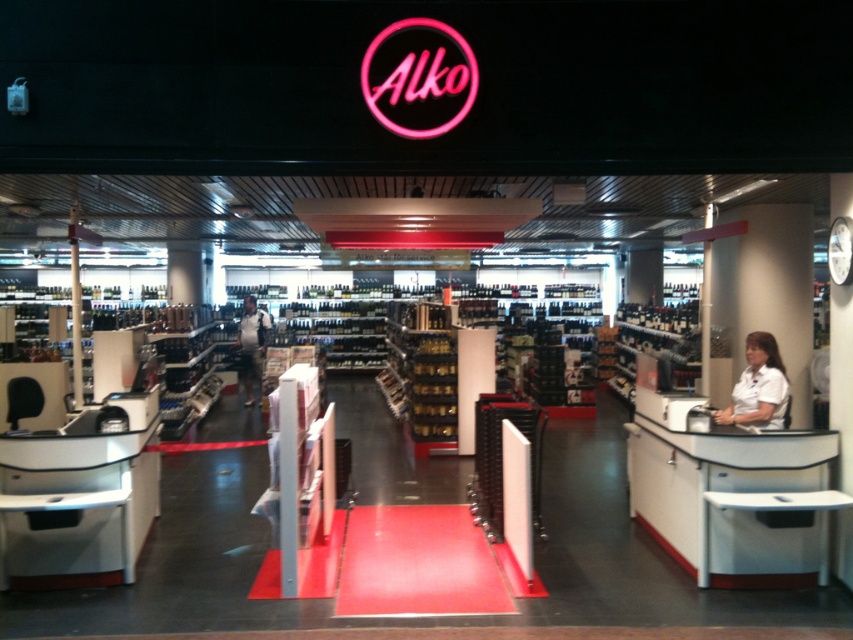
Between white smooth shirt at right and dark blue jeans at center, which one is positioned higher?

Positioned higher is white smooth shirt at right.

Is white smooth shirt at right above dark blue jeans at center?

Yes, white smooth shirt at right is above dark blue jeans at center.

The image size is (853, 640). I want to click on white smooth shirt at right, so click(758, 387).